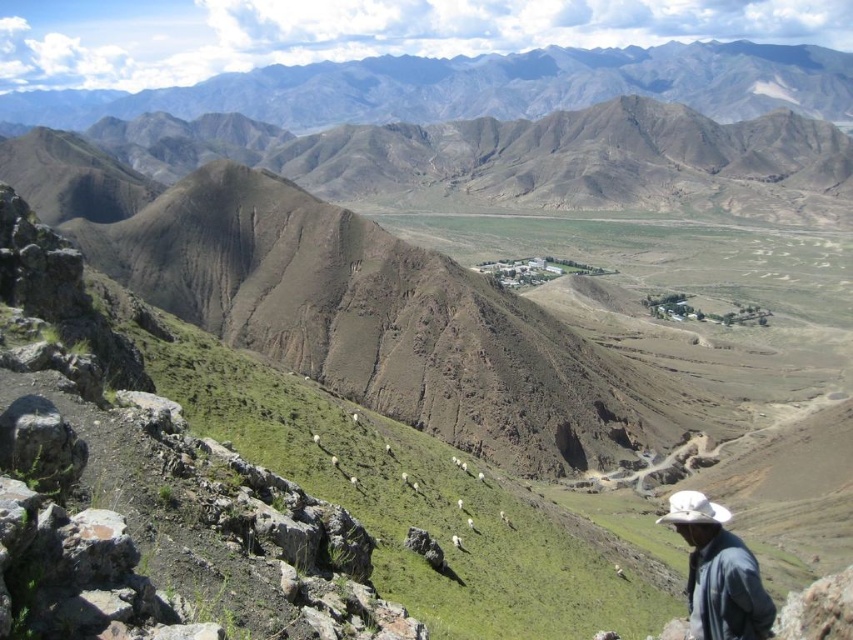
Question: Which point is closer to the camera?

Choices:
 (A) gray rocky mountains at upper center
 (B) dark blue denim jacket at lower right

Answer: (B)

Question: Which point is closer to the camera?

Choices:
 (A) dark blue denim jacket at lower right
 (B) gray rocky mountains at upper center

Answer: (A)

Question: Does gray rocky mountains at upper center have a smaller size compared to dark blue denim jacket at lower right?

Choices:
 (A) yes
 (B) no

Answer: (B)

Question: Is gray rocky mountains at upper center below dark blue denim jacket at lower right?

Choices:
 (A) yes
 (B) no

Answer: (B)

Question: Among these points, which one is farthest from the camera?

Choices:
 (A) (764, 593)
 (B) (432, 109)

Answer: (B)

Question: Is gray rocky mountains at upper center smaller than dark blue denim jacket at lower right?

Choices:
 (A) no
 (B) yes

Answer: (A)